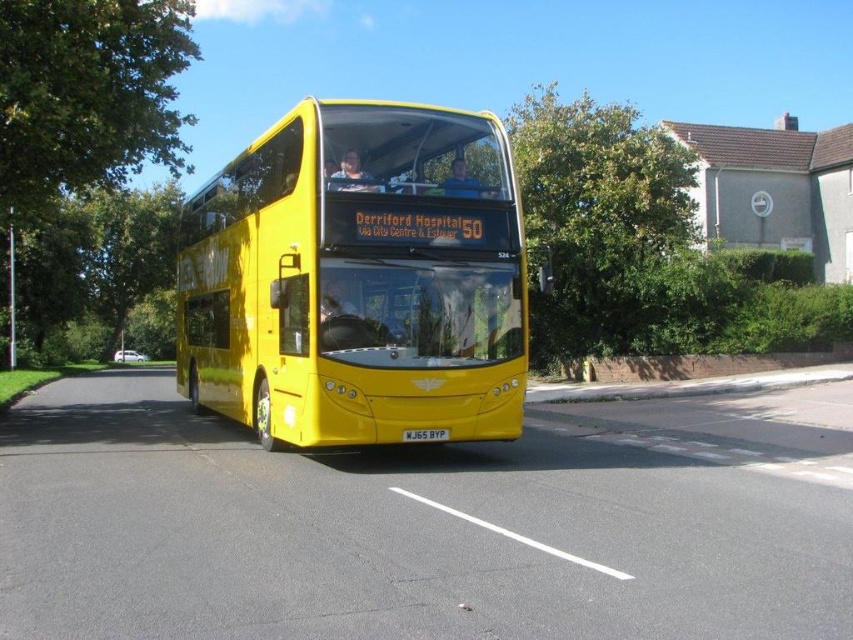
Question: Which object is positioned farthest from the yellow matte license plate at center?

Choices:
 (A) green leafy tree at left
 (B) green leafy tree at upper center
 (C) yellow matte/decorative bus at center

Answer: (A)

Question: Can you confirm if green leafy tree at left is wider than green leafy tree at upper center?

Choices:
 (A) yes
 (B) no

Answer: (A)

Question: Can you confirm if green leafy tree at left is positioned above green leafy tree at upper center?

Choices:
 (A) yes
 (B) no

Answer: (B)

Question: Which object is farther from the camera taking this photo?

Choices:
 (A) green leafy tree at upper center
 (B) green leafy tree at left
 (C) yellow matte license plate at center

Answer: (A)

Question: Estimate the real-world distances between objects in this image. Which object is farther from the yellow matte license plate at center?

Choices:
 (A) green leafy tree at upper center
 (B) yellow matte/decorative bus at center
 (C) green leafy tree at left

Answer: (C)

Question: Does yellow matte/decorative bus at center appear under green leafy tree at left?

Choices:
 (A) yes
 (B) no

Answer: (A)